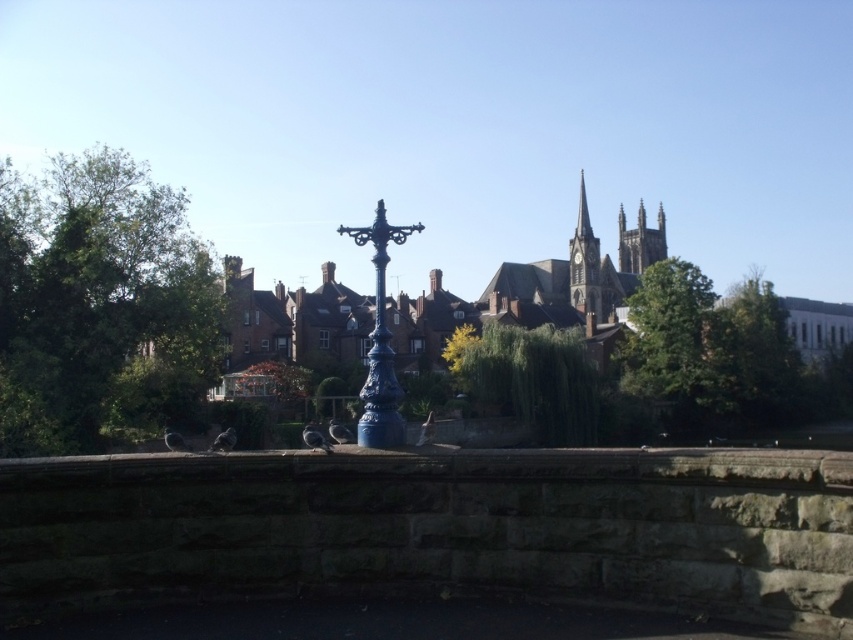
You are a photographer planning to capture the historic church spire in the background. You have a camera with a limited field of view. If you want to include both the green leafy tree at left and the blue cast iron lamp post at center in your shot, which object should you position closer to the edge of the frame to avoid overcrowding?

Since the green leafy tree at left is larger in size than the blue cast iron lamp post at center, you should position the green leafy tree at left closer to the edge of the frame to avoid overcrowding while still including both in the shot.

You are a bird flying over the urban scene and want to land on a tree. Which tree is closer to the left side of the image, the green leafy tree at left or the orange leafy tree at center?

The green leafy tree at left is closer to the left side of the image because it is positioned to the left of the orange leafy tree at center.

You are a photographer standing in front of the stone wall with the dark blue ornate lamppost. You want to take a photo that includes both the green leafy tree at left and the smooth stone spire at upper right. Which object will appear larger in your photo?

The green leafy tree at left will appear larger in the photo because it is closer to the viewer than the smooth stone spire at upper right.